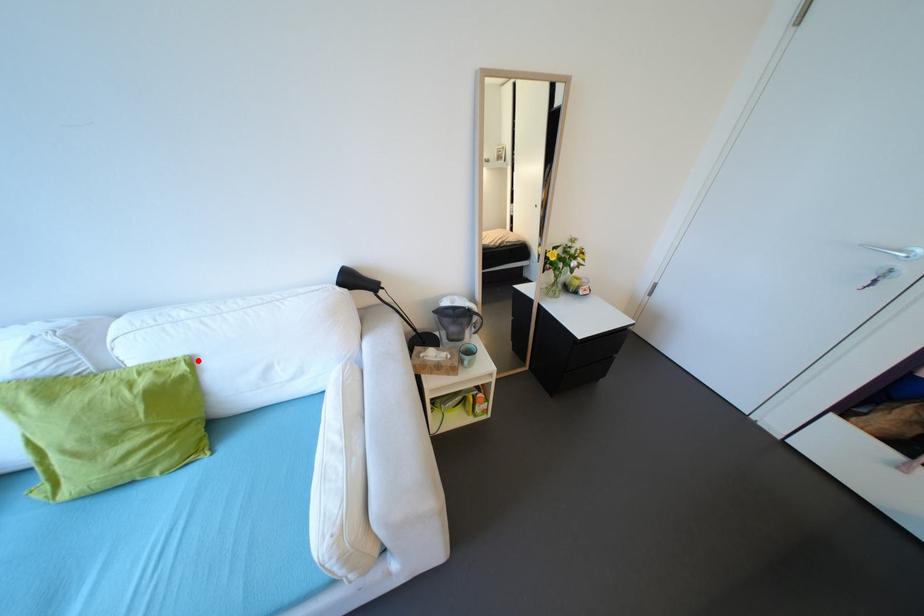
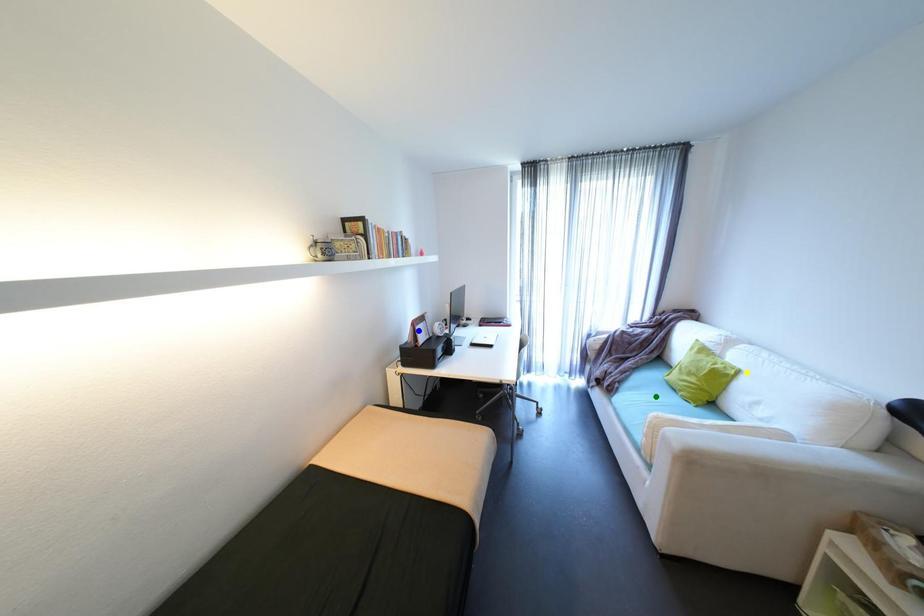
Question: I am providing you with two images of the same scene from different viewpoints. A red point is marked on the first image. You are given multiple points on the second image. In image 2, which mark is for the same physical point as the one in image 1?

Choices:
 (A) yellow point
 (B) blue point
 (C) green point

Answer: (A)